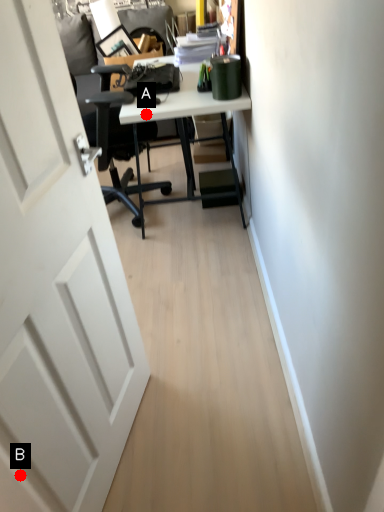
Question: Two points are circled on the image, labeled by A and B beside each circle. Which of the following is the farthest from the observer?

Choices:
 (A) A is further
 (B) B is further

Answer: (A)